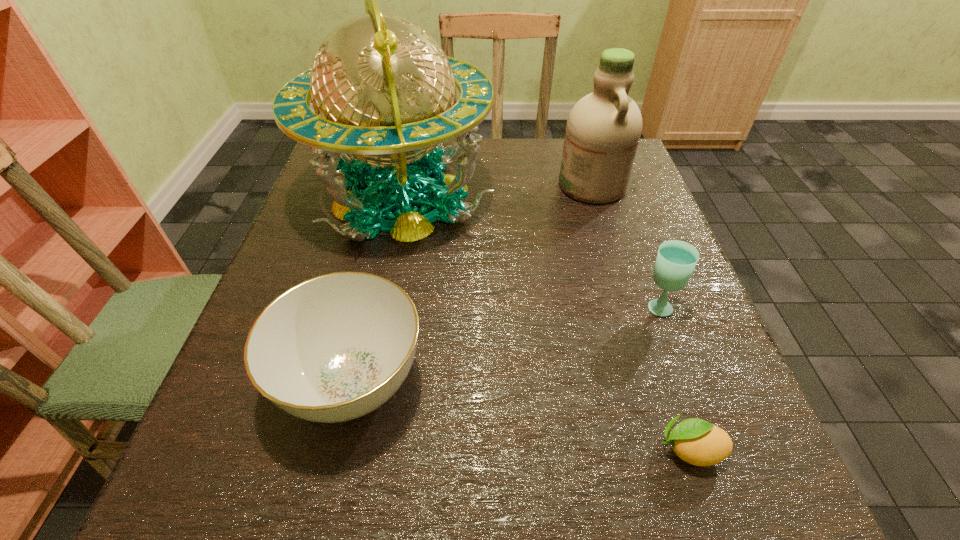
Locate an element on the screen. vacant space situated on the right of the chinaware is located at coordinates point(545,381).

Locate an element on the screen. blank space located with leaves positioned above the lemon is located at coordinates (564, 449).

The width and height of the screenshot is (960, 540). What are the coordinates of `vacant area situated with leaves positioned above the lemon` in the screenshot? It's located at (459, 449).

The height and width of the screenshot is (540, 960). I want to click on free space located with leaves positioned above the lemon, so click(x=494, y=449).

Where is `globe at the far edge`? This screenshot has height=540, width=960. globe at the far edge is located at coordinates (383, 90).

The width and height of the screenshot is (960, 540). What are the coordinates of `cleansing agent at the far edge` in the screenshot? It's located at (603, 130).

The width and height of the screenshot is (960, 540). I want to click on chinaware situated at the near edge, so 333,348.

Locate an element on the screen. This screenshot has height=540, width=960. lemon at the near edge is located at coordinates (698, 442).

The width and height of the screenshot is (960, 540). What are the coordinates of `globe at the left edge` in the screenshot? It's located at (383, 90).

You are a GUI agent. You are given a task and a screenshot of the screen. Output one action in this format:
    pyautogui.click(x=<x>, y=<y>)
    Task: Click on the chinaware that is at the left edge
    Image resolution: width=960 pixels, height=540 pixels.
    Given the screenshot: What is the action you would take?
    pyautogui.click(x=333, y=348)